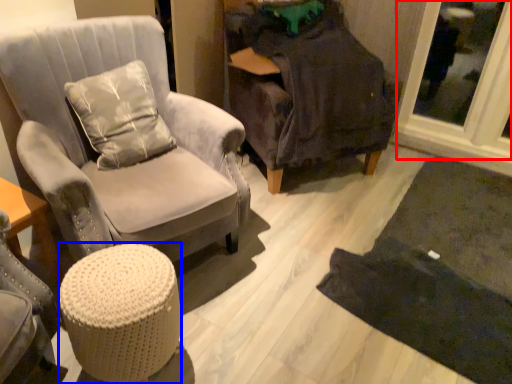
Question: Which object appears closest to the camera in this image, glass door (highlighted by a red box) or stool (highlighted by a blue box)?

Choices:
 (A) glass door
 (B) stool

Answer: (B)